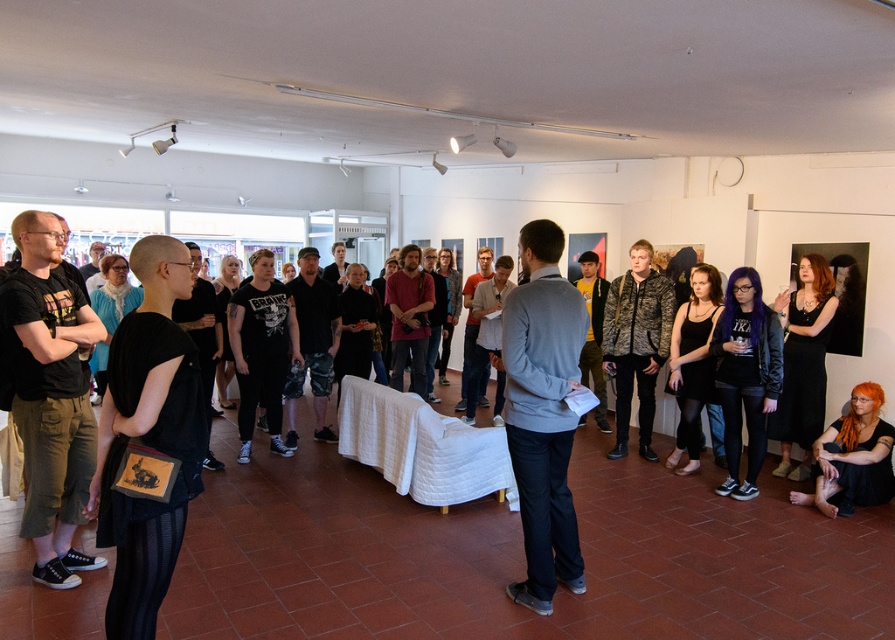
You are standing in the art gallery and want to determine which of the two points, point (558, 365) or point (842, 428), is closer to you. Based on the scene description, which point is nearer?

Point (558, 365) is closer to the viewer than point (842, 428).

You are an attendee at the art exhibition and want to take a photo of the gray sweater at center and the orange hair at lower right. Which object should you focus on first to ensure both are in clear view?

You should focus on the gray sweater at center first since it is closer to you than the orange hair at lower right, ensuring both are in clear view.

You are an artist attending an exhibition and notice two features in the scene. One is the gray sweater at center and the other is the orange hair at lower right. Which of these two features is narrower in width?

The gray sweater at center is narrower in width than the orange hair at lower right.